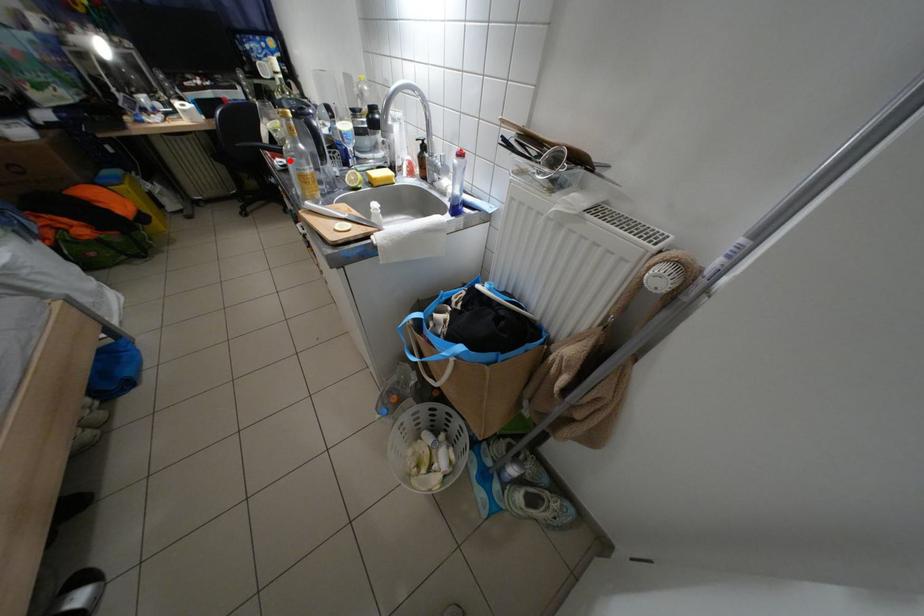
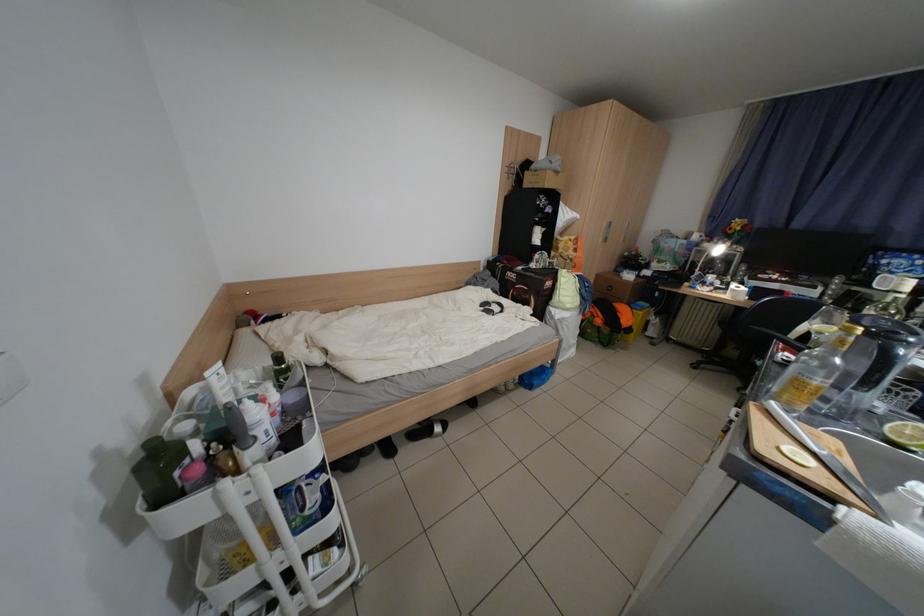
Find the pixel in the second image that matches the highlighted location in the first image.

(799, 355)